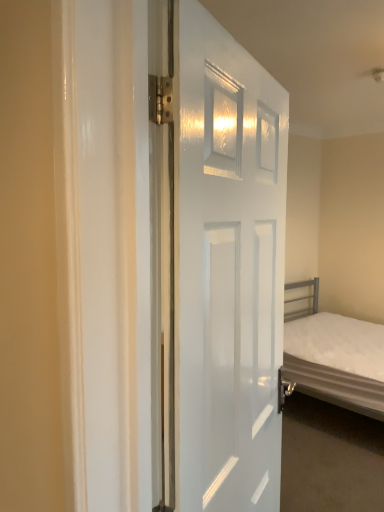
Question: Considering the relative positions of white fabric bed at right and white glossy door at center in the image provided, is white fabric bed at right to the right of white glossy door at center from the viewer's perspective?

Choices:
 (A) yes
 (B) no

Answer: (A)

Question: Is white fabric bed at right located outside white glossy door at center?

Choices:
 (A) no
 (B) yes

Answer: (B)

Question: From a real-world perspective, is white fabric bed at right physically below white glossy door at center?

Choices:
 (A) no
 (B) yes

Answer: (B)

Question: Can white glossy door at center be found inside white fabric bed at right?

Choices:
 (A) no
 (B) yes

Answer: (A)

Question: Does white fabric bed at right come in front of white glossy door at center?

Choices:
 (A) no
 (B) yes

Answer: (A)

Question: Is white fabric bed at right positioned behind white glossy door at center?

Choices:
 (A) no
 (B) yes

Answer: (B)

Question: Is white glossy door at center shorter than white fabric bed at right?

Choices:
 (A) no
 (B) yes

Answer: (A)

Question: Does white glossy door at center have a greater height compared to white fabric bed at right?

Choices:
 (A) yes
 (B) no

Answer: (A)

Question: From the image's perspective, is white glossy door at center above white fabric bed at right?

Choices:
 (A) no
 (B) yes

Answer: (B)

Question: Considering the relative sizes of white glossy door at center and white fabric bed at right in the image provided, is white glossy door at center bigger than white fabric bed at right?

Choices:
 (A) no
 (B) yes

Answer: (A)

Question: Are white glossy door at center and white fabric bed at right making contact?

Choices:
 (A) yes
 (B) no

Answer: (B)

Question: Is white glossy door at center positioned far away from white fabric bed at right?

Choices:
 (A) no
 (B) yes

Answer: (B)

Question: From a real-world perspective, is white fabric bed at right physically located above or below white glossy door at center?

Choices:
 (A) above
 (B) below

Answer: (B)